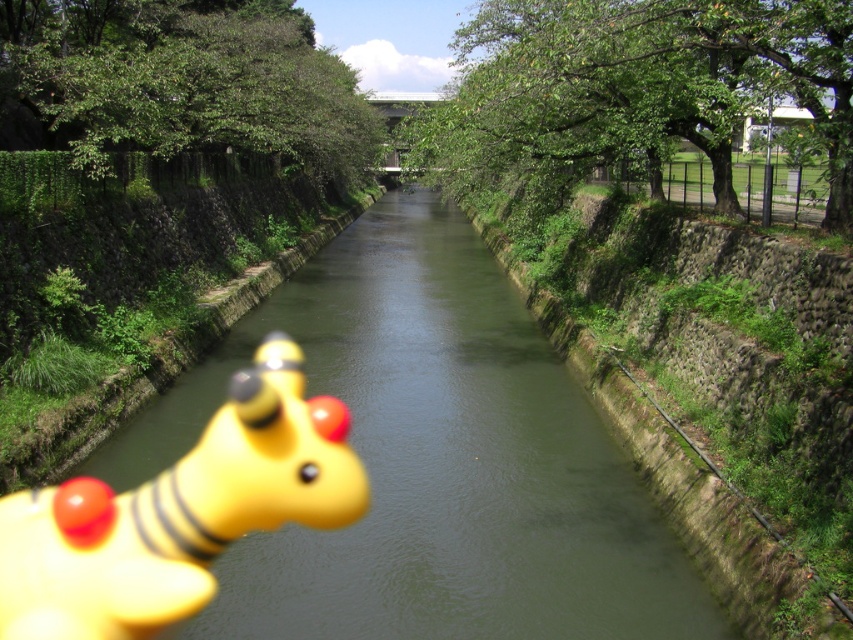
Is green stone creek at center positioned at the back of yellow rubber toy at lower left?

Yes, it is behind yellow rubber toy at lower left.

Can you confirm if green stone creek at center is smaller than yellow rubber toy at lower left?

Incorrect, green stone creek at center is not smaller in size than yellow rubber toy at lower left.

Is point (653, 528) positioned before point (39, 541)?

No, it is not.

The image size is (853, 640). Find the location of `green stone creek at center`. green stone creek at center is located at coordinates (433, 460).